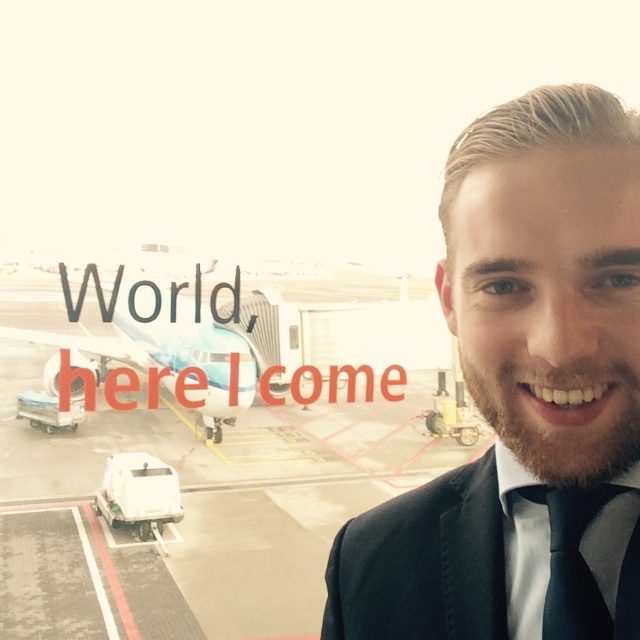
You are a photographer taking a picture of the black satin business suit at right and the light blue metallic airplane at left. Which object should you zoom in on to make them appear the same size in the photo?

To make the black satin business suit at right and the light blue metallic airplane at left appear the same size in the photo, you should zoom in on the black satin business suit at right because it is smaller than the airplane.

You are a fashion designer observing a man in a black satin business suit at right and a black silk tie at right. Which clothing item is positioned lower on his body?

The black satin business suit at right is positioned lower on his body than the black silk tie at right.